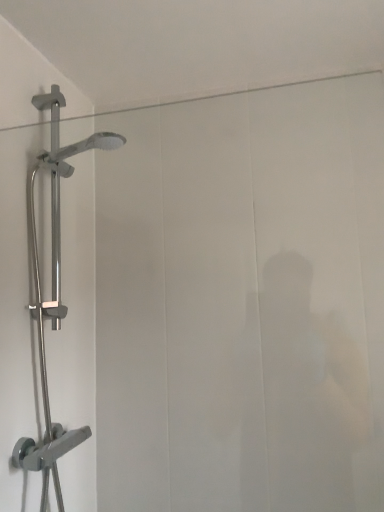
What do you see at coordinates (53, 293) in the screenshot? This screenshot has height=512, width=384. I see `transparent glass shower door at left` at bounding box center [53, 293].

Locate an element on the screen. The image size is (384, 512). transparent glass shower door at left is located at coordinates (53, 293).

You are a GUI agent. You are given a task and a screenshot of the screen. Output one action in this format:
    pyautogui.click(x=<x>, y=<y>)
    Task: Click on the transparent glass shower door at left
    The height and width of the screenshot is (512, 384).
    Given the screenshot: What is the action you would take?
    pyautogui.click(x=53, y=293)